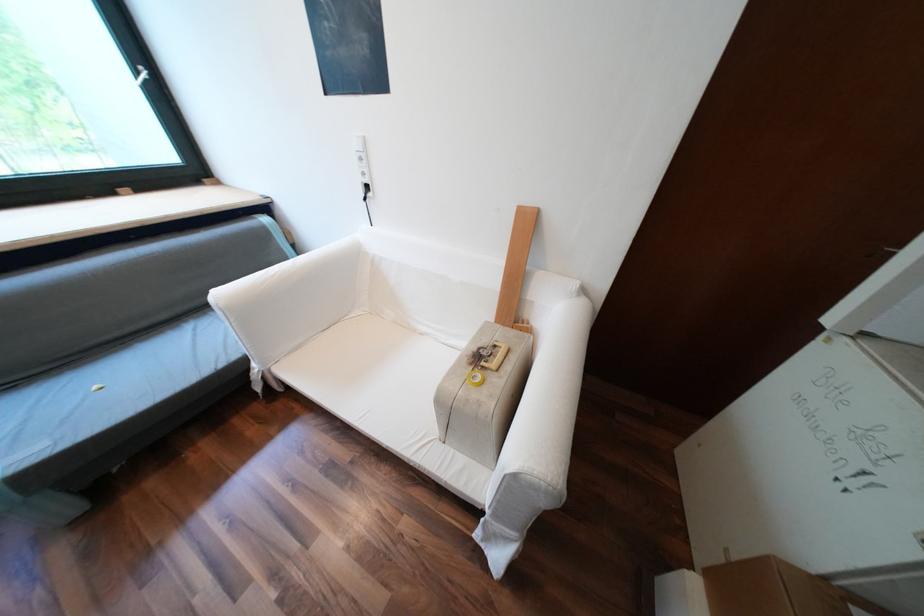
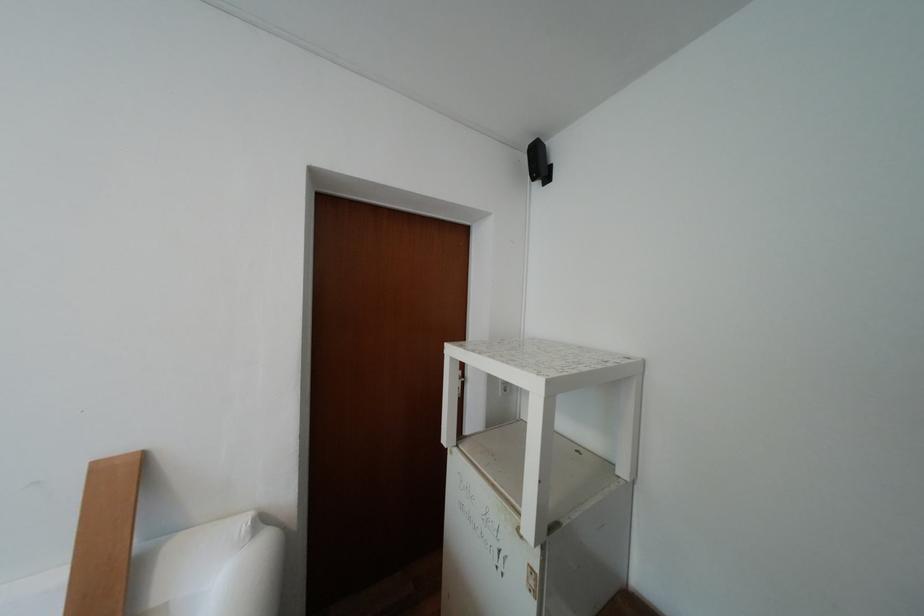
The point at (530, 211) is marked in the first image. Where is the corresponding point in the second image?

(111, 468)